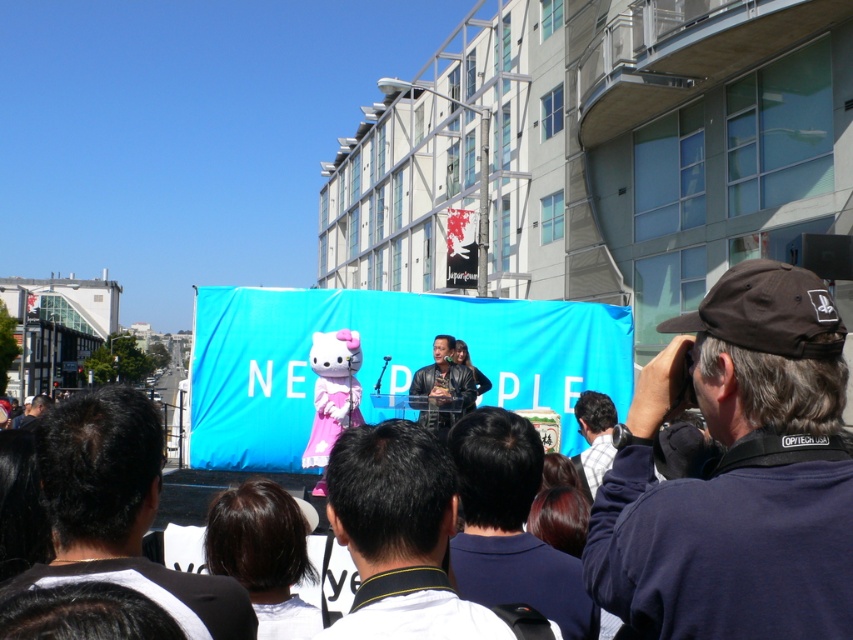
Question: Which point appears farthest from the camera in this image?

Choices:
 (A) (735, 592)
 (B) (473, 385)

Answer: (B)

Question: Does black fabric cap at upper right have a lesser width compared to leather jacket at center?

Choices:
 (A) yes
 (B) no

Answer: (A)

Question: Can you confirm if dark blue shirt at center is positioned to the right of leather jacket at center?

Choices:
 (A) yes
 (B) no

Answer: (A)

Question: Where is black fabric at center located in relation to white shirt at center in the image?

Choices:
 (A) above
 (B) below

Answer: (A)

Question: Which object is the closest to the black fabric cap at upper right?

Choices:
 (A) white shirt at center
 (B) dark blue shirt at center
 (C) leather jacket at center

Answer: (A)

Question: Considering the real-world distances, which object is closest to the white shirt at center?

Choices:
 (A) black fabric cap at upper right
 (B) black fabric at center

Answer: (B)